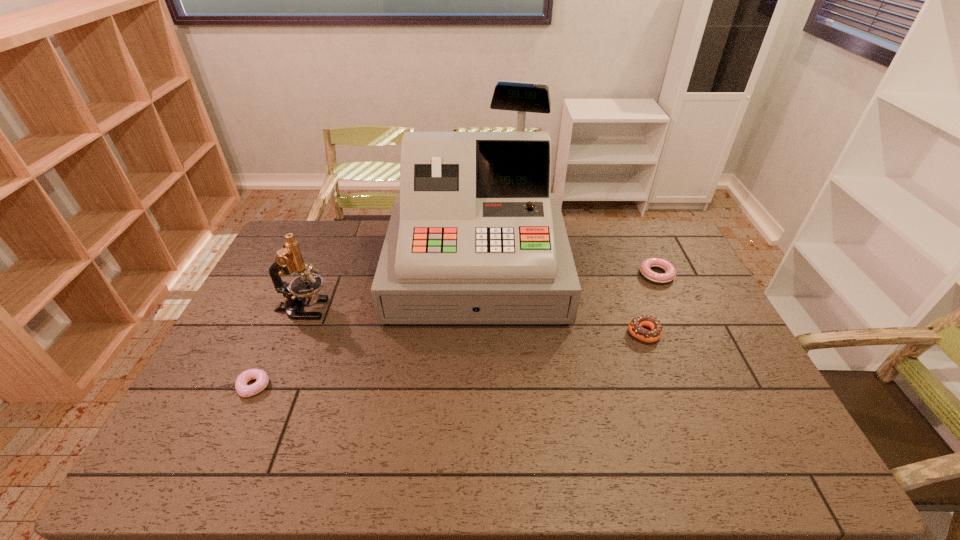
Find the location of `vacant point at the left edge`. vacant point at the left edge is located at coordinates point(268,291).

Image resolution: width=960 pixels, height=540 pixels. In the image, there is a desktop. Identify the location of vacant space at the right edge. (732, 343).

The width and height of the screenshot is (960, 540). In the image, there is a desktop. Find the location of `free space at the far left corner`. free space at the far left corner is located at coordinates tap(316, 249).

Identify the location of free space at the far right corner of the desktop. (661, 240).

This screenshot has width=960, height=540. In the image, there is a desktop. Find the location of `vacant space at the near right corner`. vacant space at the near right corner is located at coordinates (790, 469).

Image resolution: width=960 pixels, height=540 pixels. Identify the location of blank region between the cash register and the nearest object. [366, 328].

What are the coordinates of `free spot between the tallest doughnut and the leftmost doughnut` in the screenshot? It's located at (449, 360).

What are the coordinates of `free space between the rightmost object and the tallest doughnut` in the screenshot? It's located at (651, 303).

Identify the location of free space between the nearest object and the tallest doughnut. The width and height of the screenshot is (960, 540). (449, 360).

I want to click on vacant point located between the microscope and the leftmost doughnut, so click(x=278, y=348).